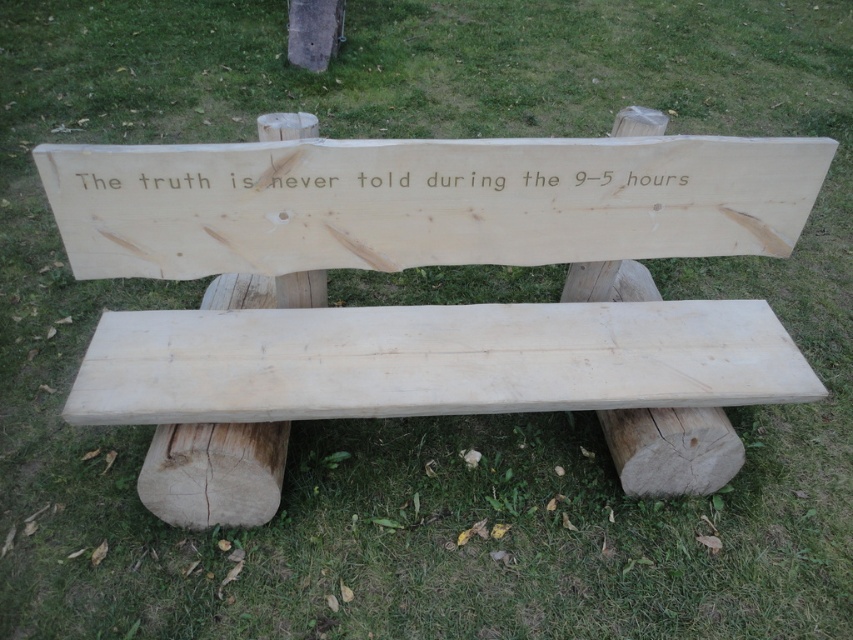
Question: Which point appears closest to the camera in this image?

Choices:
 (A) click(x=416, y=179)
 (B) click(x=526, y=173)

Answer: (A)

Question: Can you confirm if natural wood sign at center is positioned above white wood text at center?

Choices:
 (A) yes
 (B) no

Answer: (B)

Question: Observing the image, what is the correct spatial positioning of natural wood sign at center in reference to white wood text at center?

Choices:
 (A) right
 (B) left

Answer: (A)

Question: Can you confirm if natural wood sign at center is bigger than white wood text at center?

Choices:
 (A) yes
 (B) no

Answer: (A)